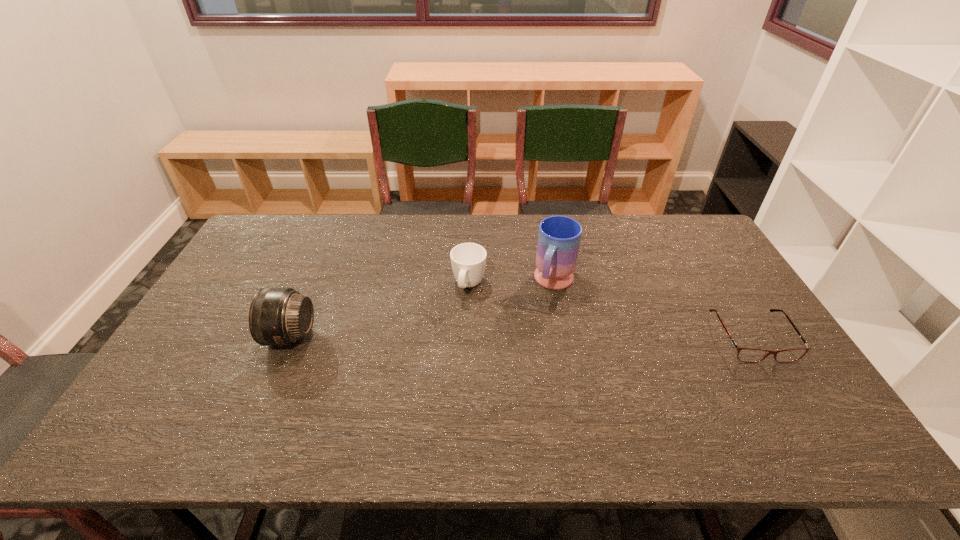
In order to click on the leftmost object in this screenshot , I will do `click(277, 316)`.

Where is `the second tallest object`? Image resolution: width=960 pixels, height=540 pixels. the second tallest object is located at coordinates (277, 316).

Find the location of a particular element. This screenshot has height=540, width=960. the rightmost object is located at coordinates [x=751, y=355].

Identify the location of spectacles. (751, 355).

Find the location of a particular element. mug is located at coordinates (559, 237).

Locate an element on the screen. the tallest object is located at coordinates (559, 237).

Image resolution: width=960 pixels, height=540 pixels. I want to click on cup, so click(468, 260).

You are a GUI agent. You are given a task and a screenshot of the screen. Output one action in this format:
    pyautogui.click(x=<x>, y=<y>)
    Task: Click on the third object from right to left
    The image size is (960, 540).
    Given the screenshot: What is the action you would take?
    pyautogui.click(x=468, y=260)

You are a GUI agent. You are given a task and a screenshot of the screen. Output one action in this format:
    pyautogui.click(x=<x>, y=<y>)
    Task: Click on the vacant space situated on the front-facing side of the leftmost object
    
    Given the screenshot: What is the action you would take?
    pyautogui.click(x=204, y=336)

Identify the location of vacant area situated 0.110m on the front-facing side of the leftmost object. The width and height of the screenshot is (960, 540). (227, 336).